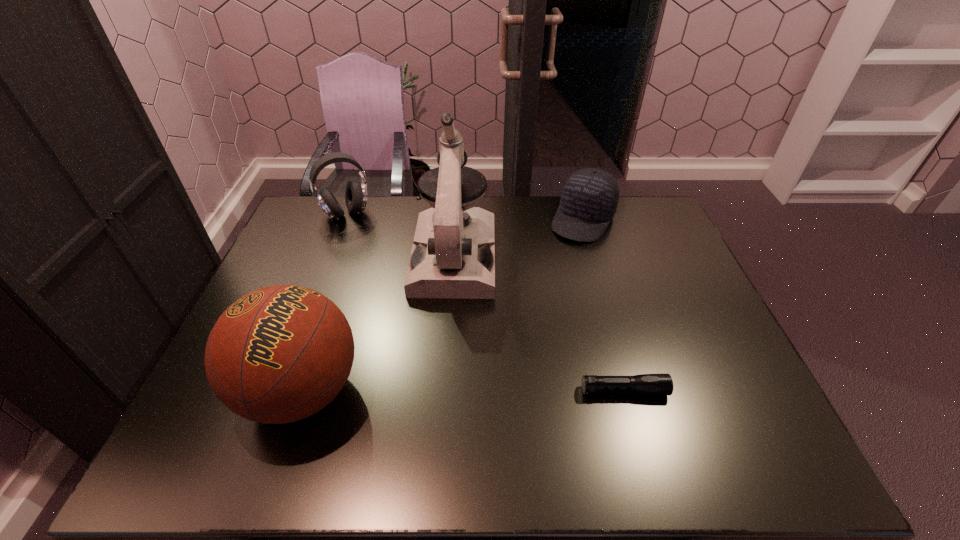
At what (x,y) coordinates should I click in order to perform the action: click on vacant space on the desktop that is between the second tallest object and the flashlight and is positioned at the eyepiece of the microscope. Please return your answer as a coordinate pair (x, y). This screenshot has height=540, width=960. Looking at the image, I should click on (442, 391).

Find the location of `vacant spot on the desktop that is between the fourth shortest object and the flashlight and is positioned on the ear cups of the third tallest object`. vacant spot on the desktop that is between the fourth shortest object and the flashlight and is positioned on the ear cups of the third tallest object is located at coordinates (418, 391).

Identify the location of free spot on the desktop that is between the basketball and the shortest object and is positioned at the front of the baseball cap where the brim is located. (476, 390).